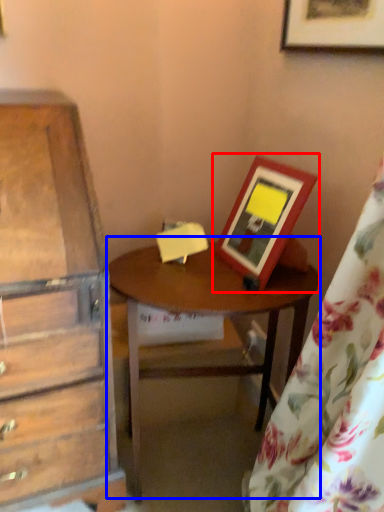
Question: Which object is further to the camera taking this photo, picture frame (highlighted by a red box) or table (highlighted by a blue box)?

Choices:
 (A) picture frame
 (B) table

Answer: (B)